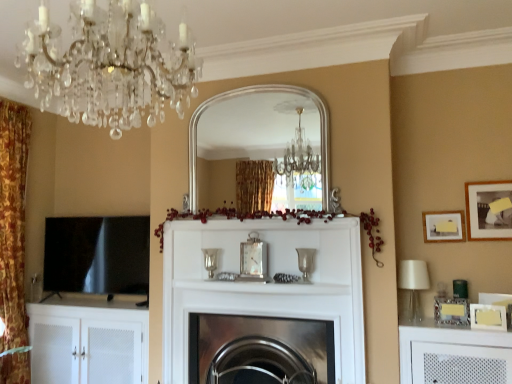
Question: Relative to matte white picture frame at upper right, the 2th picture frame viewed from the top, is matte silver picture frame at upper right, the 4th picture frame positioned from the bottom, in front or behind?

Choices:
 (A) behind
 (B) front

Answer: (B)

Question: From the image's perspective, is matte silver picture frame at upper right, the first picture frame positioned from the top, above or below matte white picture frame at upper right, marked as the third picture frame in a bottom-to-top arrangement?

Choices:
 (A) above
 (B) below

Answer: (A)

Question: Estimate the real-world distances between objects in this image. Which object is closer to the crystal glass chandelier at upper left?

Choices:
 (A) white glass lampshade at right
 (B) white matte cabinet at left
 (C) white matte picture frame at upper right, positioned as the 2th picture frame in bottom-to-top order
 (D) matte silver picture frame at upper right, the first picture frame positioned from the top
 (E) black glossy tv at left

Answer: (A)

Question: Considering the real-world distances, which object is closest to the metallic silver picture frame at right, the 4th picture frame in the top-to-bottom sequence?

Choices:
 (A) orange floral fabric curtain at left
 (B) crystal glass chandelier at upper left
 (C) white matte cabinet at left
 (D) white matte picture frame at upper right, positioned as the 2th picture frame in bottom-to-top order
 (E) white glass lampshade at right

Answer: (D)